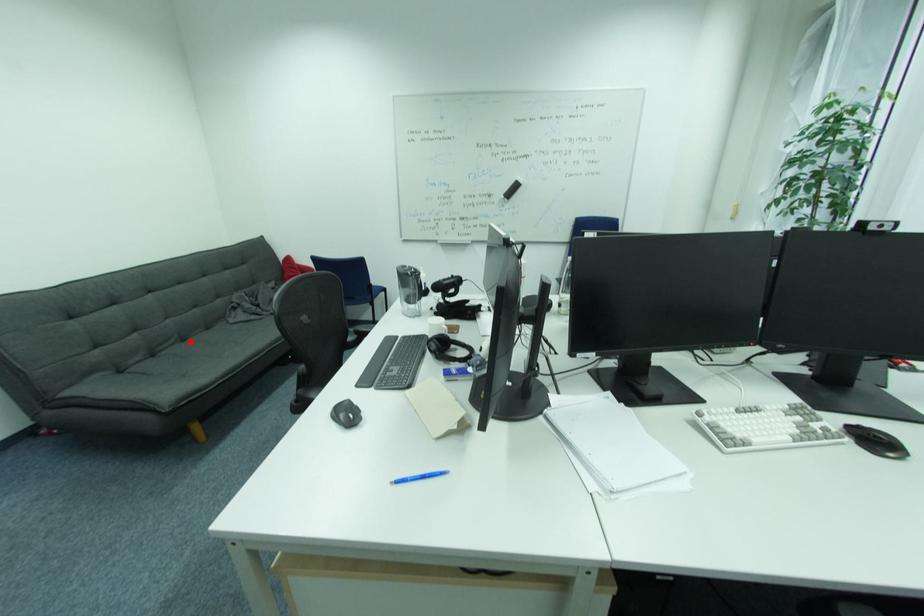
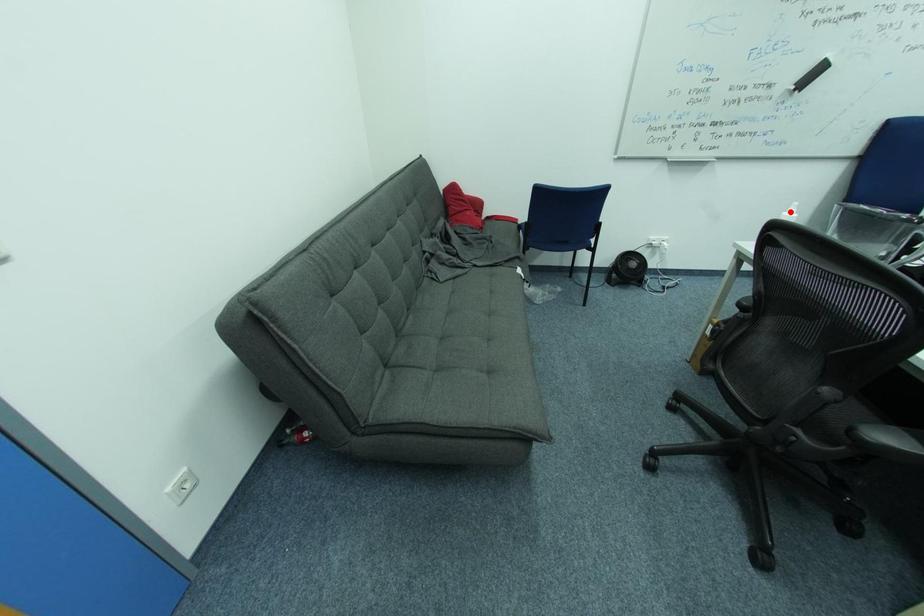
I am providing you with two images of the same scene from different viewpoints. A red point is marked on the first image and another point is marked on the second image. Is the marked point in image1 the same physical position as the marked point in image2?

No